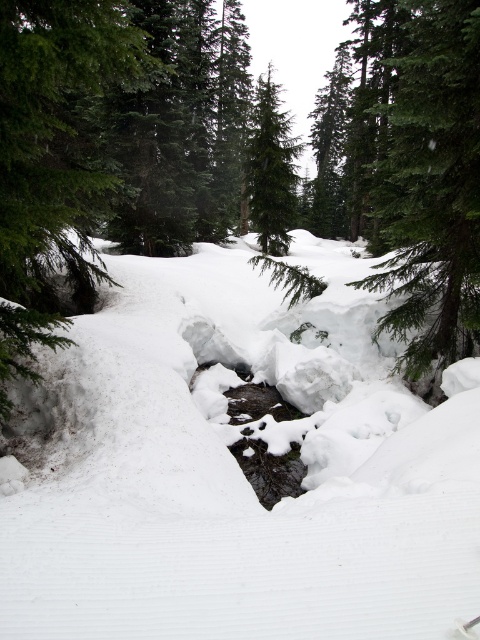
Is green textured tree at center bigger than green matte tree at center?

Actually, green textured tree at center might be smaller than green matte tree at center.

Image resolution: width=480 pixels, height=640 pixels. Identify the location of green textured tree at center. (432, 188).

In order to click on green textured tree at center in this screenshot , I will do `click(432, 188)`.

Image resolution: width=480 pixels, height=640 pixels. Find the location of `green textured tree at center`. green textured tree at center is located at coordinates (432, 188).

Does white fluffy snow at center appear under green matte tree at center?

Yes, white fluffy snow at center is below green matte tree at center.

I want to click on white fluffy snow at center, so click(x=238, y=468).

Between white fluffy snow at center and green textured tree at center, which one is positioned higher?

Positioned higher is green textured tree at center.

How distant is white fluffy snow at center from green textured tree at center?

white fluffy snow at center is 3.44 meters from green textured tree at center.

Between point (301, 406) and point (420, 124), which one is positioned behind?

The point (301, 406) is behind.

At what (x,y) coordinates should I click in order to perform the action: click on white fluffy snow at center. Please return your answer as a coordinate pair (x, y). Looking at the image, I should click on (238, 468).